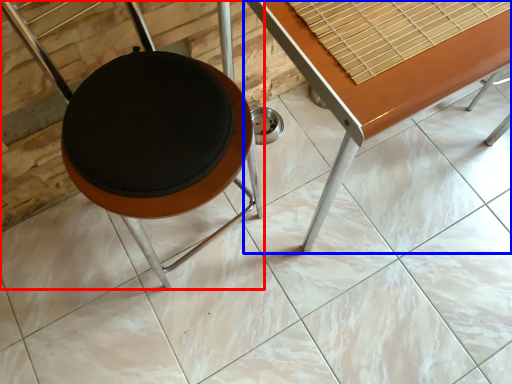
Question: Among these objects, which one is farthest to the camera, furniture (highlighted by a red box) or table (highlighted by a blue box)?

Choices:
 (A) furniture
 (B) table

Answer: (B)